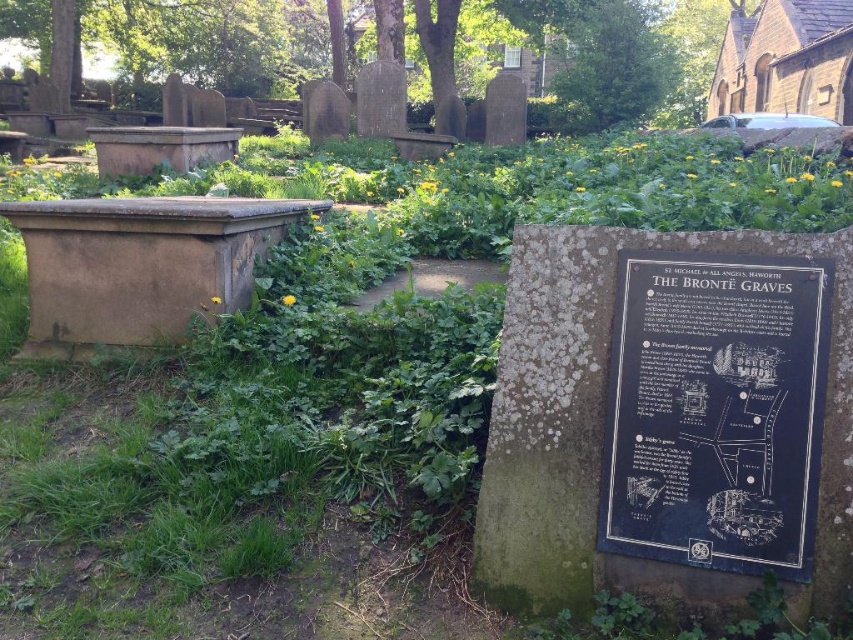
Does black polished stone plaque at center have a lesser width compared to brown stone sarcophagus at left?

Yes, black polished stone plaque at center is thinner than brown stone sarcophagus at left.

Between point (795, 410) and point (61, 253), which one is positioned behind?

Positioned behind is point (61, 253).

Is point (817, 436) positioned behind point (194, 275)?

No.

Where is `black polished stone plaque at center`? This screenshot has height=640, width=853. black polished stone plaque at center is located at coordinates (715, 410).